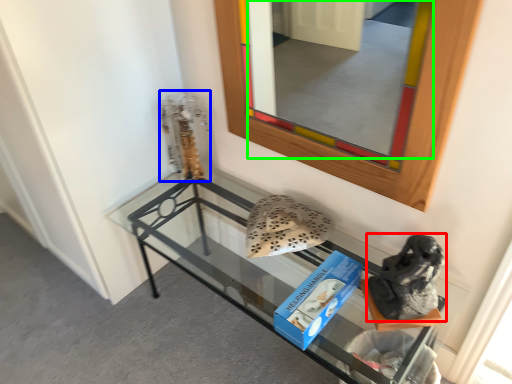
Question: Which object is the closest to the footwear (highlighted by a red box)? Choose among these: sculpture (highlighted by a blue box) or mirror (highlighted by a green box).

Choices:
 (A) sculpture
 (B) mirror

Answer: (A)